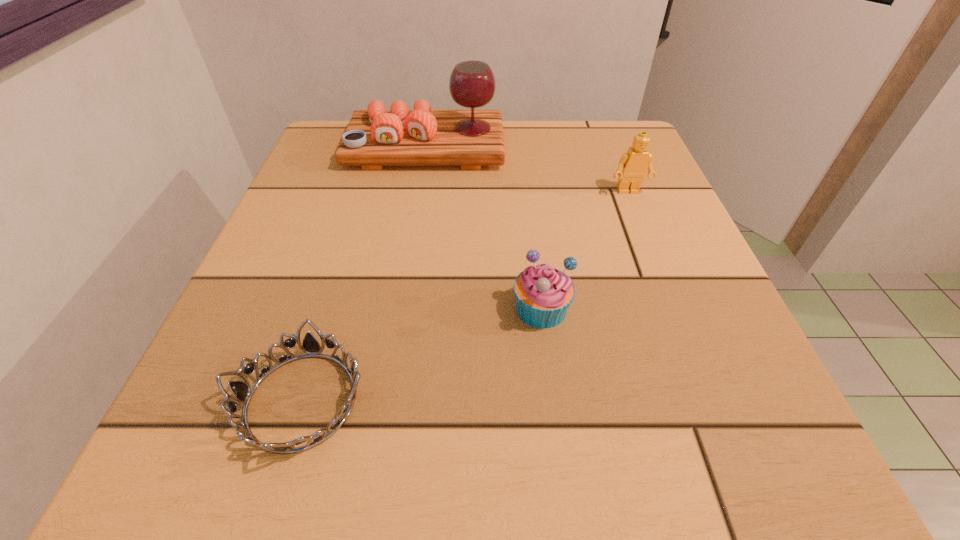
Identify the location of free location located 0.260m on the left of the third tallest object. The width and height of the screenshot is (960, 540). (335, 308).

Image resolution: width=960 pixels, height=540 pixels. Identify the location of free space located on the front-facing side of the shortest object. (604, 401).

Find the location of `object positioned at the far edge`. object positioned at the far edge is located at coordinates (375, 137).

Locate an element on the screen. The image size is (960, 540). object that is at the near edge is located at coordinates (242, 391).

Find the location of `platter present at the left edge`. platter present at the left edge is located at coordinates (375, 137).

Where is `tiara that is positioned at the left edge`? This screenshot has width=960, height=540. tiara that is positioned at the left edge is located at coordinates (242, 391).

Identify the location of object that is at the right edge. This screenshot has height=540, width=960. (633, 165).

Find the location of `object present at the far left corner`. object present at the far left corner is located at coordinates (375, 137).

At what (x,y) coordinates should I click in order to perform the action: click on object that is at the near left corner. Please return your answer as a coordinate pair (x, y). Looking at the image, I should click on (242, 391).

In the image, there is a desktop. What are the coordinates of `free space at the far edge` in the screenshot? It's located at (537, 175).